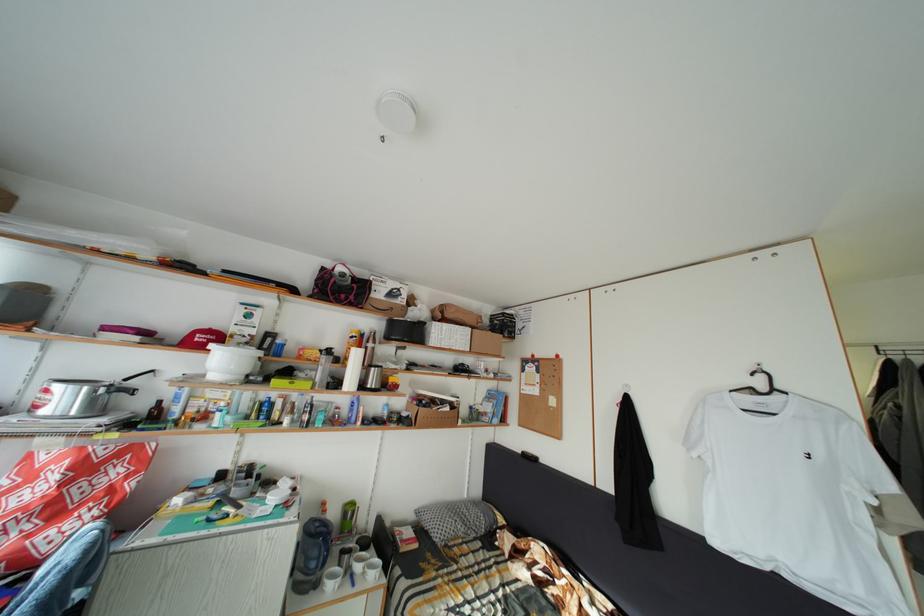
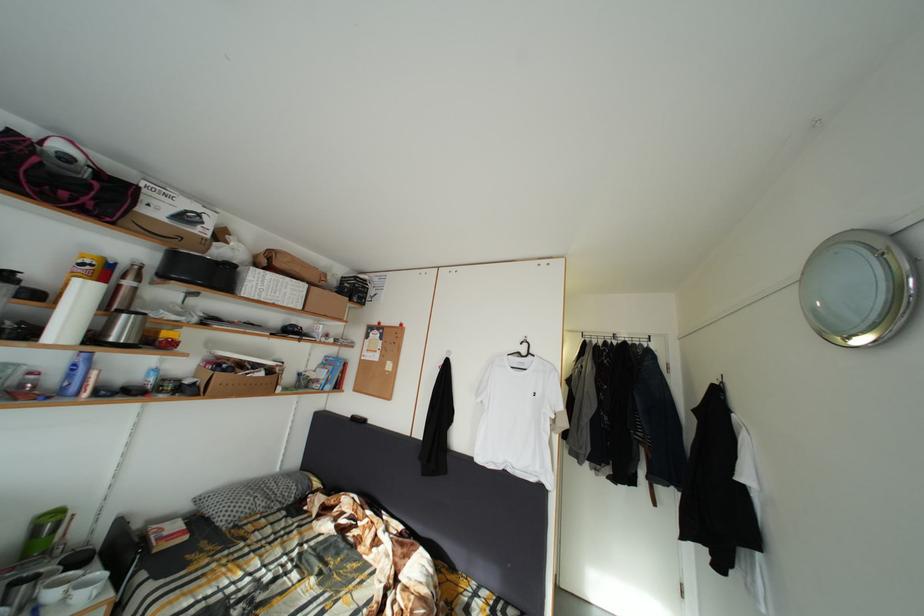
The point at [354,521] is marked in the first image. Where is the corresponding point in the second image?

(44, 537)